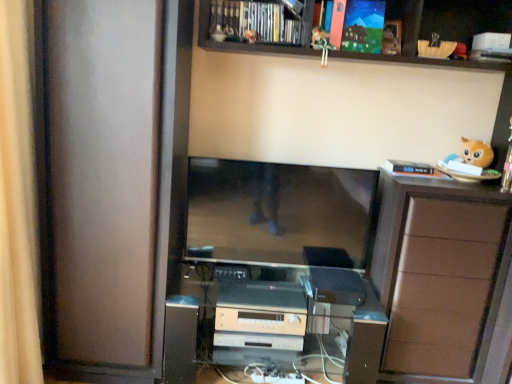
Where is `fluffy orange plush at upper right, which is counted as the 1th toy, starting from the bottom`? This screenshot has width=512, height=384. fluffy orange plush at upper right, which is counted as the 1th toy, starting from the bottom is located at coordinates (470, 163).

Where is `matte black monitor at center`? This screenshot has height=384, width=512. matte black monitor at center is located at coordinates (278, 211).

What do you see at coordinates (102, 176) in the screenshot? I see `matte brown screen door at left` at bounding box center [102, 176].

The image size is (512, 384). Describe the element at coordinates (273, 322) in the screenshot. I see `satin silver stereo at center` at that location.

You are a GUI agent. You are given a task and a screenshot of the screen. Output one action in this format:
    pyautogui.click(x=<x>, y=<y>)
    Task: Click on the brown wood cabinet at right
    This screenshot has width=512, height=384.
    Given the screenshot: What is the action you would take?
    pyautogui.click(x=439, y=273)

Find the location of a particular element. This screenshot has height=384, width=512. fluffy orange plush at upper right, which ranks as the 1th toy in right-to-left order is located at coordinates (470, 163).

Are matte brown screen door at left and wooden at upper center located far from each other?

matte brown screen door at left is near wooden at upper center, not far away.

Looking at this image, considering the relative sizes of matte brown screen door at left and wooden at upper center in the image provided, is matte brown screen door at left smaller than wooden at upper center?

No.

Consider the image. Which object is positioned more to the right, matte brown screen door at left or wooden at upper center?

wooden at upper center is more to the right.

Which object is closer to the camera taking this photo, beige plastic stereo at lower center, which is counted as the first appliance, starting from the left, or fluffy orange plush at upper right, which ranks as the 1th toy in right-to-left order?

fluffy orange plush at upper right, which ranks as the 1th toy in right-to-left order, is in front.

In terms of height, does beige plastic stereo at lower center, the second appliance viewed from the right, look taller or shorter compared to fluffy orange plush at upper right, which is counted as the 1th toy, starting from the bottom?

Considering their sizes, beige plastic stereo at lower center, the second appliance viewed from the right, has less height than fluffy orange plush at upper right, which is counted as the 1th toy, starting from the bottom.

At what (x,y) coordinates should I click in order to perform the action: click on the 2nd appliance counting from the left of the fluffy orange plush at upper right, the 2th toy positioned from the top. Please return your answer as a coordinate pair (x, y). This screenshot has width=512, height=384. Looking at the image, I should click on (261, 318).

Can you confirm if beige plastic stereo at lower center, the second appliance viewed from the right, is wider than fluffy orange plush at upper right, which is counted as the 1th toy, starting from the bottom?

Correct, the width of beige plastic stereo at lower center, the second appliance viewed from the right, exceeds that of fluffy orange plush at upper right, which is counted as the 1th toy, starting from the bottom.

Is matte black monitor at center positioned with its back to wooden at upper center?

That's not correct — matte black monitor at center is not looking away from wooden at upper center.

From a real-world perspective, is matte black monitor at center physically located above or below wooden at upper center?

Clearly, from a real-world perspective, matte black monitor at center is below wooden at upper center.

From the image's perspective, would you say matte black monitor at center is shown under wooden at upper center?

Indeed, from the image's perspective, matte black monitor at center is shown beneath wooden at upper center.

Could wooden at upper center be considered to be inside matte black monitor at center?

No, wooden at upper center is located outside of matte black monitor at center.

Is matte black monitor at center beside brown wood cabinet at right?

matte black monitor at center is not next to brown wood cabinet at right, and they're not touching.

Considering the relative sizes of matte black monitor at center and brown wood cabinet at right in the image provided, is matte black monitor at center thinner than brown wood cabinet at right?

Yes.

Between point (194, 226) and point (377, 253), which one is positioned behind?

The point (194, 226) is behind.

Which is behind, wooden at upper center or matte brown screen door at left?

Positioned behind is wooden at upper center.

Which is correct: wooden at upper center is inside matte brown screen door at left, or outside of it?

wooden at upper center is not inside matte brown screen door at left, it's outside.

Is there a large distance between wooden at upper center and matte brown screen door at left?

Actually, wooden at upper center and matte brown screen door at left are a little close together.

Considering the relative sizes of wooden at upper center and matte brown screen door at left in the image provided, is wooden at upper center smaller than matte brown screen door at left?

Correct, wooden at upper center occupies less space than matte brown screen door at left.

Between matte brown screen door at left and brown wood cabinet at right, which one has larger size?

matte brown screen door at left is bigger.

Can you confirm if matte brown screen door at left is shorter than brown wood cabinet at right?

In fact, matte brown screen door at left may be taller than brown wood cabinet at right.

Consider the image. Is brown wood cabinet at right at the back of matte brown screen door at left?

No.

Which is less distant, (343, 286) or (486, 164)?

Positioned in front is point (343, 286).

Would you say fluffy orange plush at upper right, placed as the second toy when sorted from left to right, is part of black plastic speaker at lower center, which is counted as the first appliance, starting from the right,'s contents?

No, black plastic speaker at lower center, which is counted as the first appliance, starting from the right, does not contain fluffy orange plush at upper right, placed as the second toy when sorted from left to right.

Does black plastic speaker at lower center, the 2th appliance when ordered from left to right, have a larger size compared to fluffy orange plush at upper right, the 2th toy positioned from the top?

No.

At what (x,y) coordinates should I click in order to perform the action: click on shelf on the right side of matte brown screen door at left. Please return your answer as a coordinate pair (x, y). The width and height of the screenshot is (512, 384). Looking at the image, I should click on (437, 29).

Where is `the 2nd appliance behind the fluffy orange plush at upper right, the 2th toy positioned from the top, starting your count from the anchor`? The image size is (512, 384). the 2nd appliance behind the fluffy orange plush at upper right, the 2th toy positioned from the top, starting your count from the anchor is located at coordinates (261, 318).

Estimate the real-world distances between objects in this image. Which object is closer to matte black monitor at center, beige fabric curtain at left or fluffy orange plush at upper right, which is counted as the 1th toy, starting from the bottom?

fluffy orange plush at upper right, which is counted as the 1th toy, starting from the bottom, is closer to matte black monitor at center.

Looking at the image, which one is located closer to black plastic speaker at lower center, which is counted as the first appliance, starting from the right, satin silver stereo at center or wooden cabinet at upper center?

Among the two, satin silver stereo at center is located nearer to black plastic speaker at lower center, which is counted as the first appliance, starting from the right.

Estimate the real-world distances between objects in this image. Which object is closer to satin silver stereo at center, beige plastic stereo at lower center, which is counted as the first appliance, starting from the left, or wooden cabinet at upper center?

beige plastic stereo at lower center, which is counted as the first appliance, starting from the left, lies closer to satin silver stereo at center than the other object.

Which object lies nearer to the anchor point beige fabric curtain at left, matte brown screen door at left or wooden at upper center?

Based on the image, matte brown screen door at left appears to be nearer to beige fabric curtain at left.

When comparing their distances from wooden at upper center, does fluffy orange plush at upper right, the 2th toy positioned from the top, or beige fabric curtain at left seem closer?

fluffy orange plush at upper right, the 2th toy positioned from the top, lies closer to wooden at upper center than the other object.

Which object lies further to the anchor point plush orange cat at upper center, which is the second toy from bottom to top, wooden at upper center or brown wood cabinet at right?

brown wood cabinet at right.

Based on the photo, from the image, which object appears to be nearer to matte black monitor at center, satin silver stereo at center or plush orange cat at upper center, which appears as the first toy when viewed from the top?

satin silver stereo at center.

Looking at this image, which object lies nearer to the anchor point satin silver stereo at center, black plastic speaker at lower center, which is counted as the first appliance, starting from the right, or plush orange cat at upper center, which is the second toy from bottom to top?

black plastic speaker at lower center, which is counted as the first appliance, starting from the right, is closer to satin silver stereo at center.

Locate an element on the screen. shelf between wooden cabinet at upper center and black plastic speaker at lower center, the 2th appliance when ordered from left to right, vertically is located at coordinates (437, 29).

Where is `screen door located between beige fabric curtain at left and satin silver stereo at center in the left-right direction`? This screenshot has width=512, height=384. screen door located between beige fabric curtain at left and satin silver stereo at center in the left-right direction is located at coordinates (102, 176).

The height and width of the screenshot is (384, 512). In order to click on appliance between beige plastic stereo at lower center, which is counted as the first appliance, starting from the left, and brown wood cabinet at right, in the horizontal direction in this screenshot , I will do `click(337, 286)`.

Find the location of a particular element. computer monitor between matte brown screen door at left and wooden at upper center in the horizontal direction is located at coordinates (278, 211).